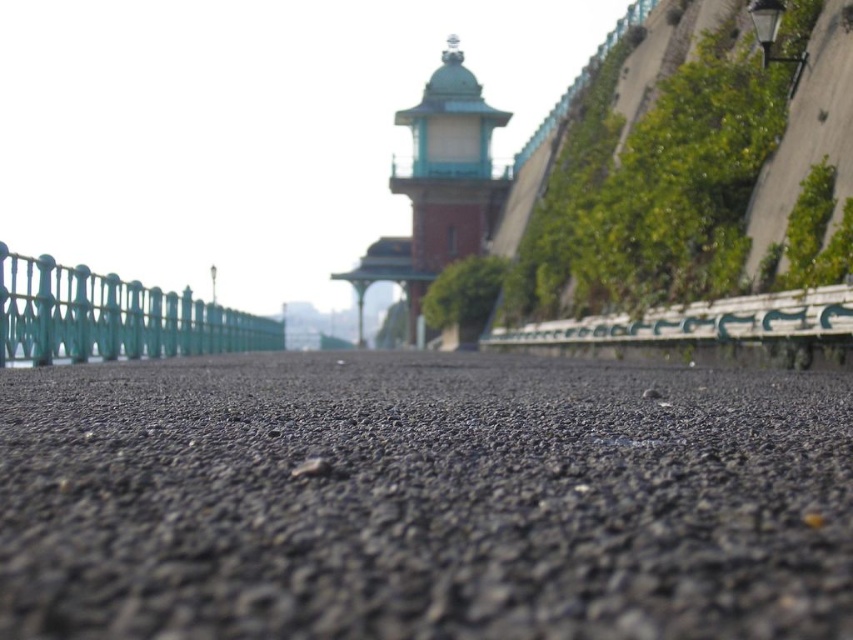
Question: Is black gravel at center positioned before teal glossy fence at left?

Choices:
 (A) no
 (B) yes

Answer: (B)

Question: Is black gravel at center positioned behind teal glossy fence at left?

Choices:
 (A) no
 (B) yes

Answer: (A)

Question: Considering the relative positions of black gravel at center and teal glossy fence at left in the image provided, where is black gravel at center located with respect to teal glossy fence at left?

Choices:
 (A) right
 (B) left

Answer: (A)